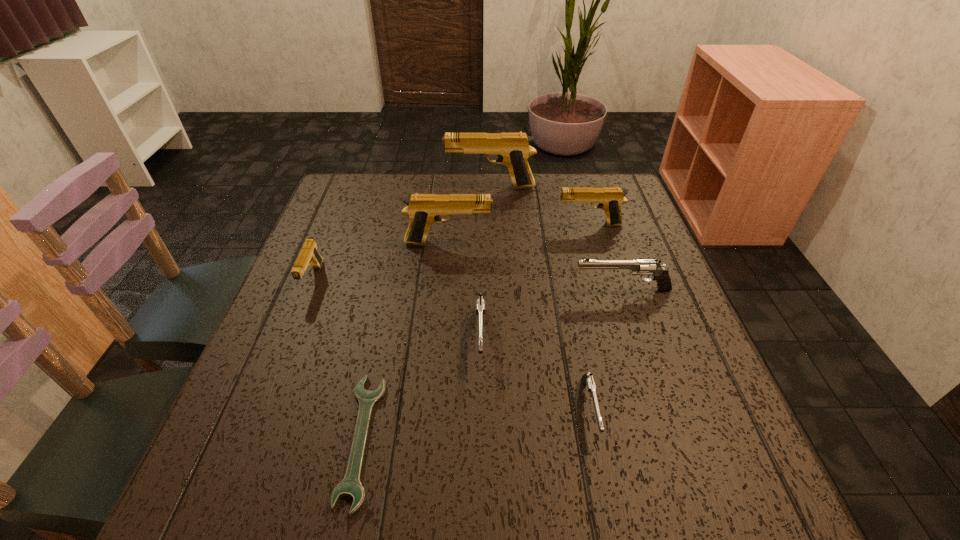
The image size is (960, 540). I want to click on empty location between the seventh tallest object and the fifth nearest pistol, so click(519, 326).

Locate an element on the screen. vacant area between the tallest pistol and the third farthest pistol is located at coordinates (469, 215).

This screenshot has height=540, width=960. What are the coordinates of `blank region between the fifth shortest pistol and the biggest tan pistol` in the screenshot? It's located at (540, 206).

Where is `vacant area that lies between the shortest object and the smallest silver pistol`? The image size is (960, 540). vacant area that lies between the shortest object and the smallest silver pistol is located at coordinates (475, 424).

The height and width of the screenshot is (540, 960). Find the location of `unoccupied position between the farthest pistol and the rightmost tan pistol`. unoccupied position between the farthest pistol and the rightmost tan pistol is located at coordinates (540, 206).

The height and width of the screenshot is (540, 960). In order to click on vacant space in between the third nearest tan pistol and the biggest silver pistol in this screenshot , I will do `click(606, 257)`.

Locate an element on the screen. The height and width of the screenshot is (540, 960). unoccupied area between the shortest object and the farthest object is located at coordinates (425, 313).

Where is `free space between the shortest pistol and the second farthest object`? The image size is (960, 540). free space between the shortest pistol and the second farthest object is located at coordinates (589, 317).

At what (x,y) coordinates should I click in order to perform the action: click on object that is the fifth closest to the seventh nearest object. Please return your answer as a coordinate pair (x, y). Image resolution: width=960 pixels, height=540 pixels. Looking at the image, I should click on (587, 379).

Identify the location of the second closest object to the second farthest silver pistol. 587,379.